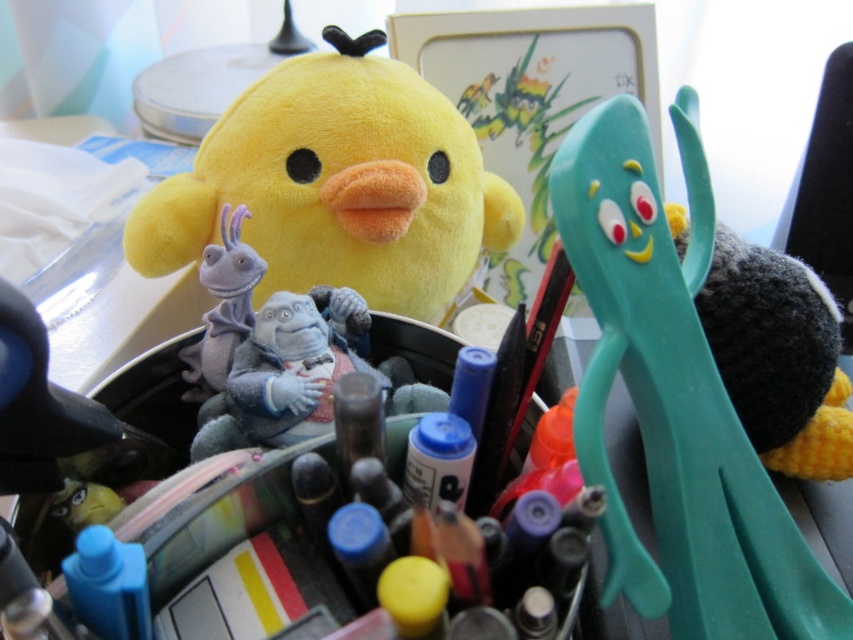
Question: From the image, what is the correct spatial relationship of teal plastic scissors at right in relation to soft yellow plush at upper left?

Choices:
 (A) above
 (B) below

Answer: (B)

Question: Among these objects, which one is nearest to the camera?

Choices:
 (A) soft yellow plush at upper left
 (B) teal plastic scissors at right
 (C) fuzzy gray plush at center

Answer: (B)

Question: Estimate the real-world distances between objects in this image. Which object is closer to the fuzzy gray plush at center?

Choices:
 (A) teal plastic scissors at right
 (B) soft yellow plush at upper left

Answer: (B)

Question: Does teal plastic scissors at right have a smaller size compared to soft yellow plush at upper left?

Choices:
 (A) yes
 (B) no

Answer: (A)

Question: Is soft yellow plush at upper left in front of fuzzy gray plush at center?

Choices:
 (A) no
 (B) yes

Answer: (A)

Question: Among these objects, which one is nearest to the camera?

Choices:
 (A) fuzzy gray plush at center
 (B) teal plastic scissors at right
 (C) soft yellow plush at upper left

Answer: (B)